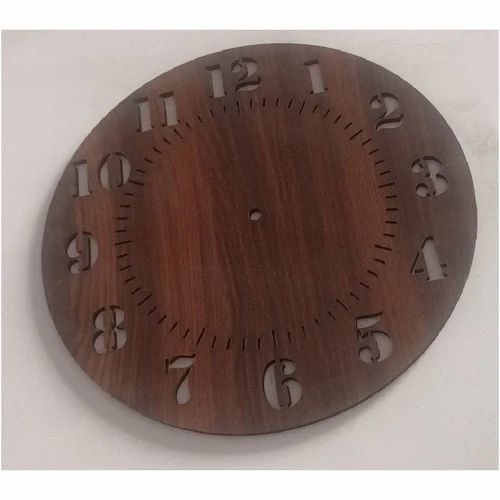
Locate an element on the screen. Image resolution: width=500 pixels, height=500 pixels. wall is located at coordinates (405, 416).